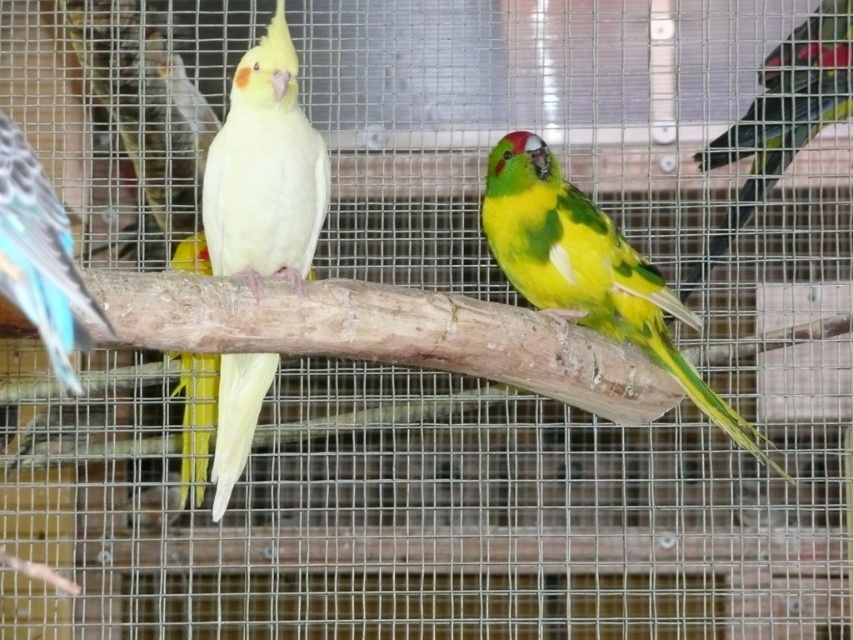
You are a bird enthusiast observing the birds in the cage. You notice the blue glossy wing at left and the yellow matte parrot at center. Which object is located to the right of the other?

The blue glossy wing at left is positioned on the right side of the yellow matte parrot at center, so the blue glossy wing at left is to the right of the yellow matte parrot at center.

You are standing in front of the birdcage and want to reach a point located at coordinate point [84,292] inside the cage to place a treat. Considering your arm length is 0.7 meters, can you reach that point without touching the cage bars?

The distance between you and point [84,292] is 1.32 meters, which is longer than your arm length of 0.7 meters. Therefore, you cannot reach the point without touching the cage bars.

You are a bird trainer observing the two points inside the birdcage. Which point is closer to you, point (222,464) or point (184,401)?

Point (222,464) is in front of point (184,401), so it is closer to you.